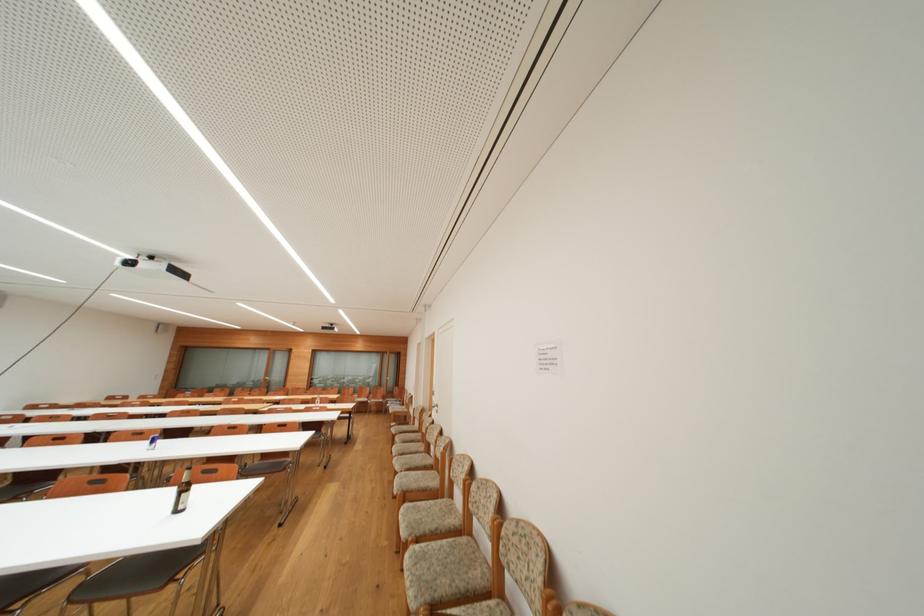
I want to click on patterned chair seat, so click(x=483, y=565).